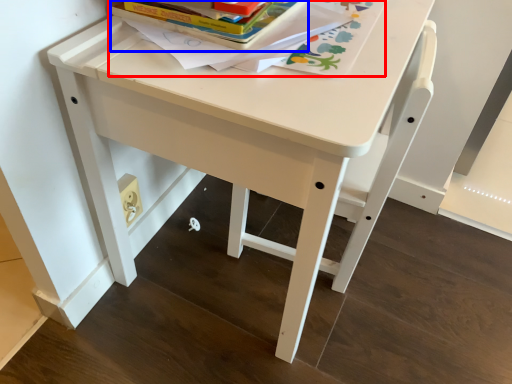
Question: Among these objects, which one is nearest to the camera, book (highlighted by a red box) or paperback book (highlighted by a blue box)?

Choices:
 (A) book
 (B) paperback book

Answer: (A)